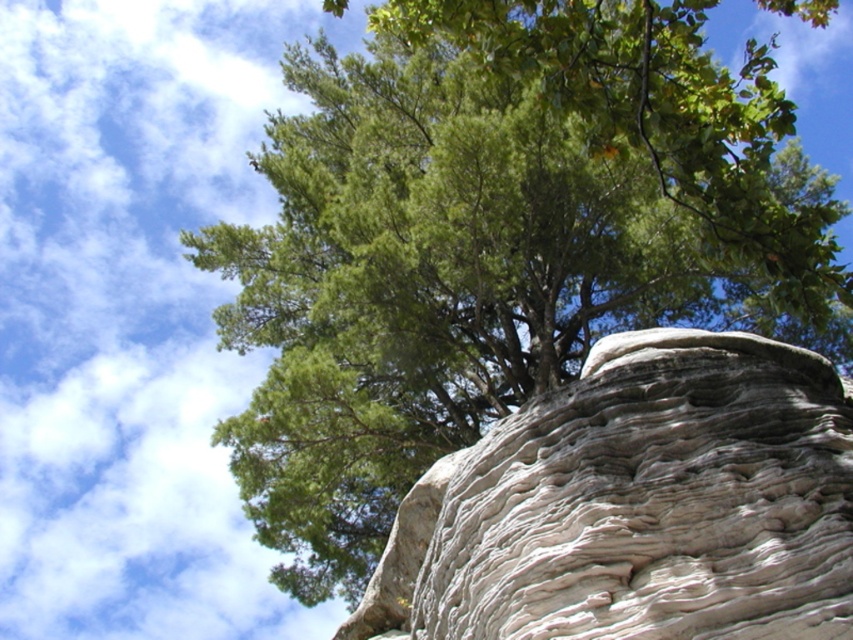
Is point (698, 538) positioned after point (694, 67)?

That is False.

The image size is (853, 640). Describe the element at coordinates (637, 506) in the screenshot. I see `white textured rock at center` at that location.

This screenshot has width=853, height=640. Describe the element at coordinates (637, 506) in the screenshot. I see `white textured rock at center` at that location.

Identify the location of white textured rock at center. (637, 506).